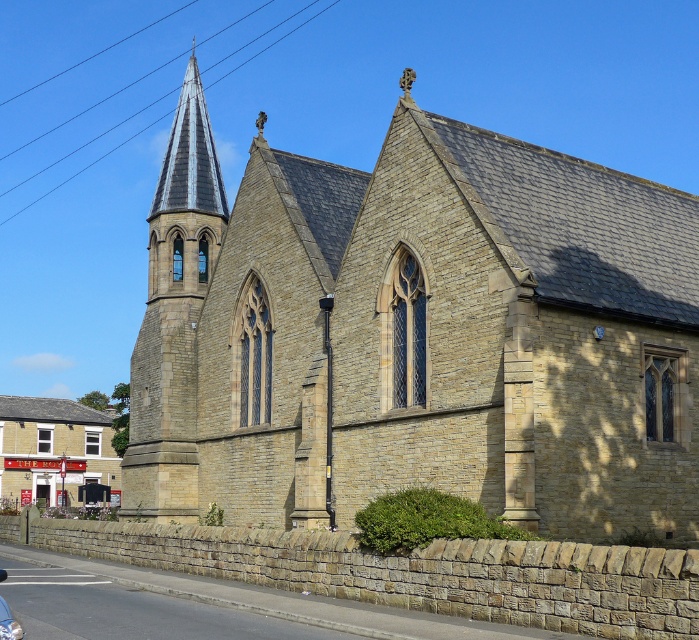
Is light brown stone pub at lower left to the left of shiny silver car at lower left from the viewer's perspective?

Yes, light brown stone pub at lower left is to the left of shiny silver car at lower left.

Identify the location of light brown stone pub at lower left. Image resolution: width=699 pixels, height=640 pixels. (52, 449).

Does stone church at center lie behind gray slate spire at upper left?

No, it is in front of gray slate spire at upper left.

Who is positioned more to the right, stone church at center or gray slate spire at upper left?

stone church at center is more to the right.

At what (x,y) coordinates should I click in order to perform the action: click on stone church at center. Please return your answer as a coordinate pair (x, y). This screenshot has width=699, height=640. Looking at the image, I should click on (415, 333).

Is gray slate spire at upper left below light brown stone pub at lower left?

No.

In the scene shown: Does gray slate spire at upper left appear over light brown stone pub at lower left?

Indeed, gray slate spire at upper left is positioned over light brown stone pub at lower left.

Where is `gray slate spire at upper left`? gray slate spire at upper left is located at coordinates (173, 316).